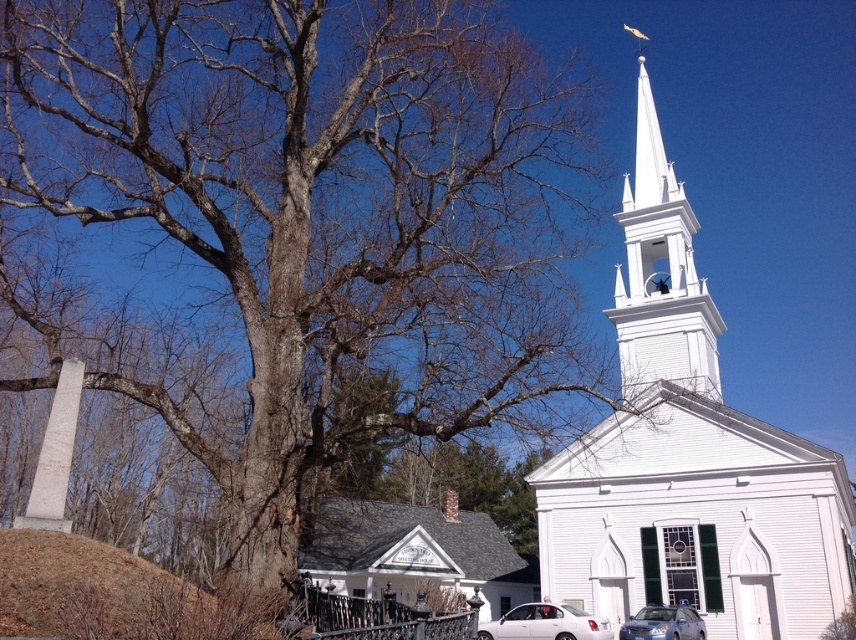
Who is shorter, white wooden church steeple at upper center or white glossy sedan at center?

white glossy sedan at center

Is white wooden church steeple at upper center bigger than white glossy sedan at center?

Yes.

Identify the location of white wooden church steeple at upper center. The height and width of the screenshot is (640, 856). (688, 456).

Does white wooden church steeple at upper center have a larger size compared to brown dirt mound at lower left?

Correct, white wooden church steeple at upper center is larger in size than brown dirt mound at lower left.

Between white wooden church steeple at upper center and brown dirt mound at lower left, which one is positioned higher?

white wooden church steeple at upper center is higher up.

This screenshot has height=640, width=856. Find the location of `white wooden church steeple at upper center`. white wooden church steeple at upper center is located at coordinates [688, 456].

Is black wrought iron fence at lower center below satin silver sedan at lower center?

No, black wrought iron fence at lower center is not below satin silver sedan at lower center.

Between black wrought iron fence at lower center and satin silver sedan at lower center, which one is positioned higher?

Positioned higher is black wrought iron fence at lower center.

Image resolution: width=856 pixels, height=640 pixels. What do you see at coordinates (378, 616) in the screenshot? I see `black wrought iron fence at lower center` at bounding box center [378, 616].

Where is `black wrought iron fence at lower center`? Image resolution: width=856 pixels, height=640 pixels. black wrought iron fence at lower center is located at coordinates tap(378, 616).